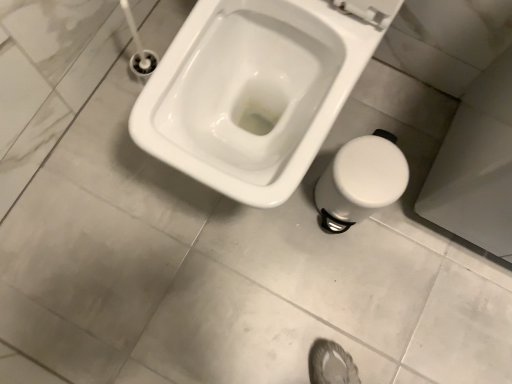
Question: Considering the positions of white glossy toilet at center and white plastic bidet at lower right in the image, is white glossy toilet at center bigger or smaller than white plastic bidet at lower right?

Choices:
 (A) big
 (B) small

Answer: (A)

Question: Which is correct: white glossy toilet at center is inside white plastic bidet at lower right, or outside of it?

Choices:
 (A) inside
 (B) outside

Answer: (B)

Question: Considering their positions, is white glossy toilet at center located in front of or behind white plastic bidet at lower right?

Choices:
 (A) behind
 (B) front

Answer: (B)

Question: Considering the positions of white plastic bidet at lower right and white glossy toilet at center in the image, is white plastic bidet at lower right taller or shorter than white glossy toilet at center?

Choices:
 (A) short
 (B) tall

Answer: (A)

Question: Is white plastic bidet at lower right situated inside white glossy toilet at center or outside?

Choices:
 (A) inside
 (B) outside

Answer: (B)

Question: In terms of size, does white plastic bidet at lower right appear bigger or smaller than white glossy toilet at center?

Choices:
 (A) big
 (B) small

Answer: (B)

Question: Based on their positions, is white plastic bidet at lower right located to the left or right of white glossy toilet at center?

Choices:
 (A) right
 (B) left

Answer: (A)